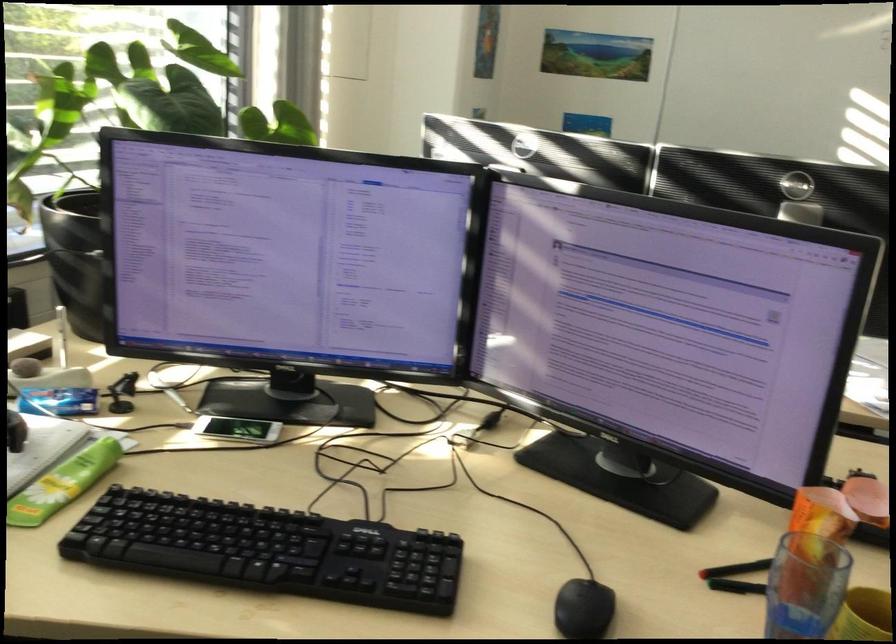
Where is `black marker`? The image size is (896, 644). black marker is located at coordinates (736, 569).